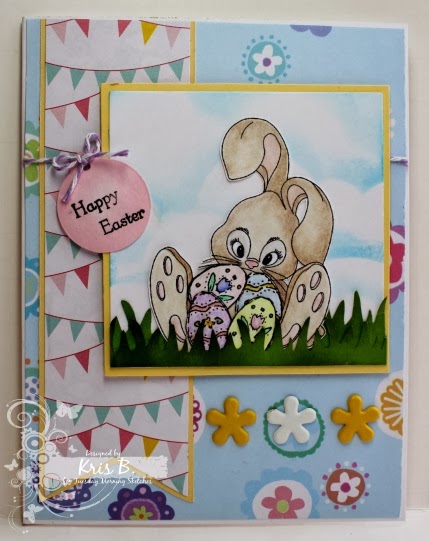
The height and width of the screenshot is (541, 429). I want to click on artwork, so tap(354, 289).